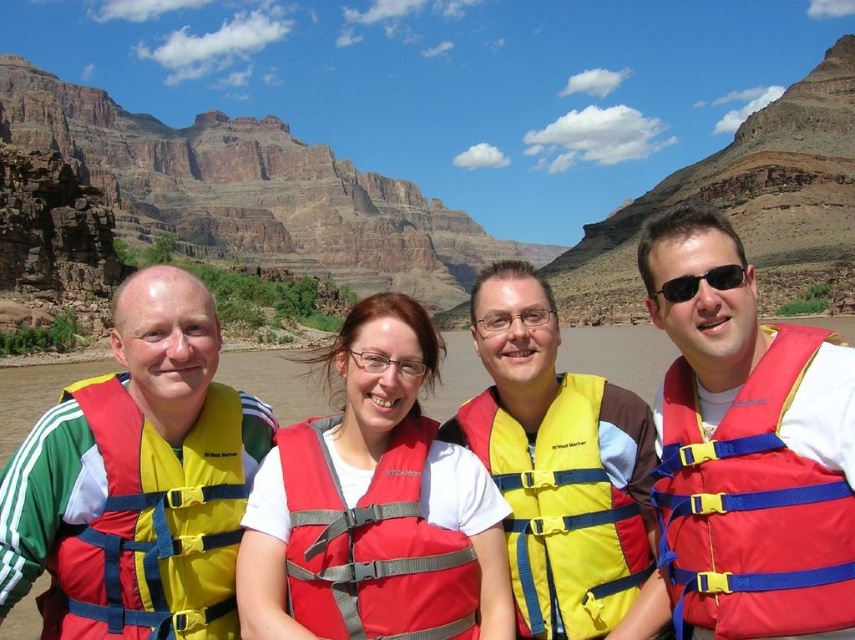
Is matte red life vest at center taller than matte yellow life jacket at left?

Correct, matte red life vest at center is much taller as matte yellow life jacket at left.

This screenshot has height=640, width=855. What do you see at coordinates (373, 500) in the screenshot?
I see `matte red life vest at center` at bounding box center [373, 500].

At what (x,y) coordinates should I click in order to perform the action: click on matte red life vest at center. Please return your answer as a coordinate pair (x, y). Image resolution: width=855 pixels, height=640 pixels. Looking at the image, I should click on (373, 500).

How much distance is there between red fabric life jacket at right and matte yellow life jacket at left?

red fabric life jacket at right is 65.99 feet from matte yellow life jacket at left.

Measure the distance between point [758,364] and camera.

They are 104.84 feet apart.

Locate an element on the screen. This screenshot has height=640, width=855. red fabric life jacket at right is located at coordinates (752, 506).

Does matte yellow life jacket at left appear under matte red life jacket at center?

Incorrect, matte yellow life jacket at left is not positioned below matte red life jacket at center.

Which of these two, matte yellow life jacket at left or matte red life jacket at center, stands taller?

matte yellow life jacket at left is taller.

Describe the element at coordinates (152, 524) in the screenshot. This screenshot has width=855, height=640. I see `matte yellow life jacket at left` at that location.

Locate an element on the screen. matte yellow life jacket at left is located at coordinates (152, 524).